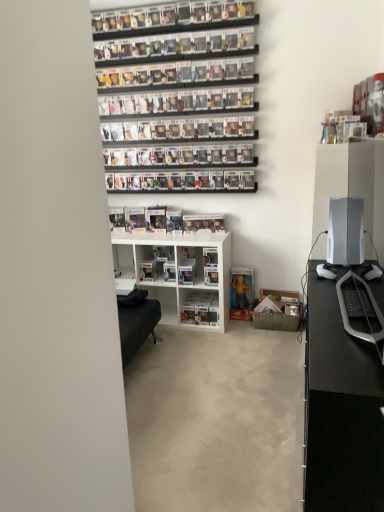
Question: Can you confirm if clear plastic figure at center is wider than yellow matte action figure at lower center?

Choices:
 (A) yes
 (B) no

Answer: (B)

Question: From a real-world perspective, is clear plastic figure at center below yellow matte action figure at lower center?

Choices:
 (A) yes
 (B) no

Answer: (B)

Question: Considering the relative positions of clear plastic figure at center and yellow matte action figure at lower center in the image provided, is clear plastic figure at center to the left of yellow matte action figure at lower center from the viewer's perspective?

Choices:
 (A) no
 (B) yes

Answer: (B)

Question: From the image's perspective, is clear plastic figure at center over yellow matte action figure at lower center?

Choices:
 (A) no
 (B) yes

Answer: (B)

Question: Is clear plastic figure at center positioned far away from yellow matte action figure at lower center?

Choices:
 (A) no
 (B) yes

Answer: (A)

Question: From a real-world perspective, relative to beige carpet at center, is clear plastic figure at center vertically above or below?

Choices:
 (A) above
 (B) below

Answer: (A)

Question: In terms of size, does clear plastic figure at center appear bigger or smaller than beige carpet at center?

Choices:
 (A) small
 (B) big

Answer: (A)

Question: Visually, is clear plastic figure at center positioned to the left or to the right of beige carpet at center?

Choices:
 (A) left
 (B) right

Answer: (B)

Question: Looking at their shapes, would you say clear plastic figure at center is wider or thinner than beige carpet at center?

Choices:
 (A) thin
 (B) wide

Answer: (A)

Question: From a real-world perspective, is white plastic shelf at center, which is the 2th shelf in left-to-right order, positioned above or below clear plastic figure at center?

Choices:
 (A) above
 (B) below

Answer: (B)

Question: From the image's perspective, relative to clear plastic figure at center, is white plastic shelf at center, which is the 2th shelf in left-to-right order, above or below?

Choices:
 (A) below
 (B) above

Answer: (A)

Question: Based on their sizes in the image, would you say white plastic shelf at center, the first shelf when ordered from right to left, is bigger or smaller than clear plastic figure at center?

Choices:
 (A) big
 (B) small

Answer: (A)

Question: Does point (193, 316) appear closer or farther from the camera than point (200, 218)?

Choices:
 (A) farther
 (B) closer

Answer: (B)

Question: From the image's perspective, relative to white glossy desktop at right, is black glossy desk at right above or below?

Choices:
 (A) below
 (B) above

Answer: (A)

Question: From a real-world perspective, is black glossy desk at right positioned above or below white glossy desktop at right?

Choices:
 (A) below
 (B) above

Answer: (A)